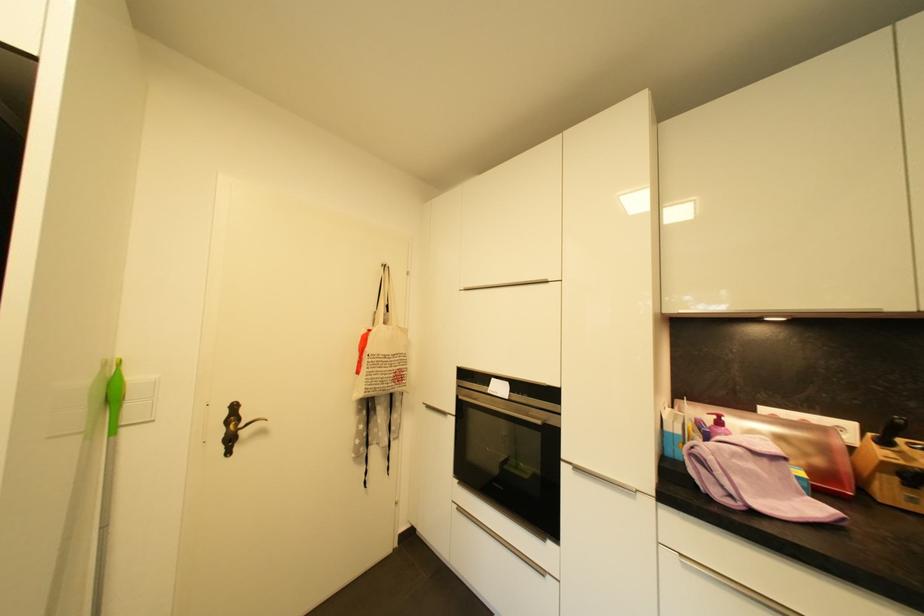
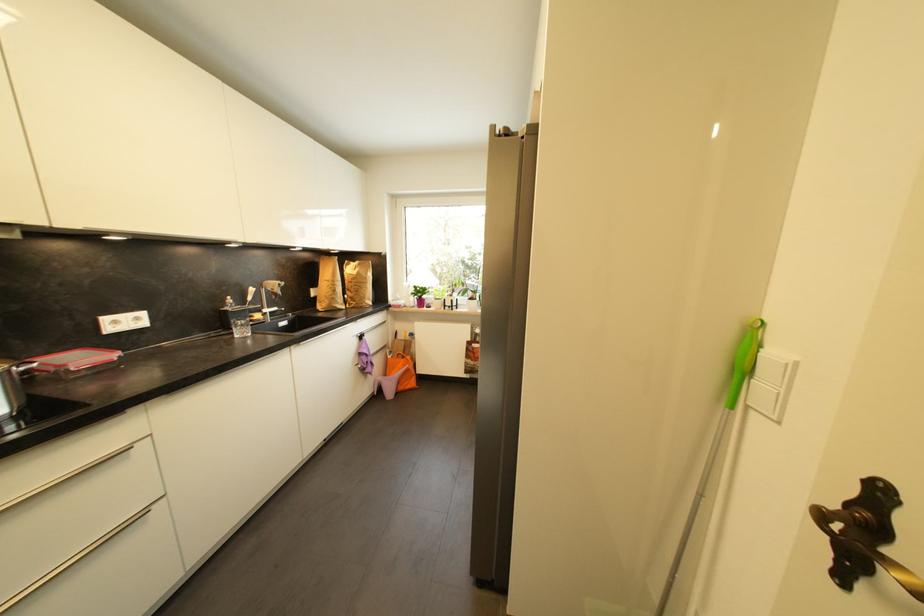
The point at (x=234, y=455) is marked in the first image. Where is the corresponding point in the second image?

(846, 581)